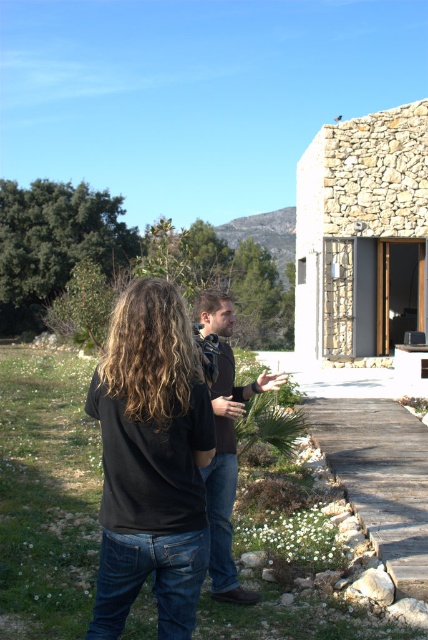
Is black matte shirt at center to the left of wooden at center from the viewer's perspective?

Correct, you'll find black matte shirt at center to the left of wooden at center.

Does black matte shirt at center have a greater width compared to wooden at center?

No.

Measure the distance between black matte shirt at center and camera.

They are 2.58 meters apart.

The height and width of the screenshot is (640, 428). I want to click on black matte shirt at center, so click(x=151, y=461).

Consider the image. Can you confirm if black matte shirt at center is positioned to the right of brown leather jacket at center?

In fact, black matte shirt at center is to the left of brown leather jacket at center.

This screenshot has width=428, height=640. Identify the location of black matte shirt at center. (151, 461).

In the scene shown: Is wooden at center thinner than brown leather jacket at center?

No, wooden at center is not thinner than brown leather jacket at center.

Does point (354, 424) come farther from viewer compared to point (223, 464)?

Yes, point (354, 424) is behind point (223, 464).

Does point (403, 518) come farther from viewer compared to point (226, 428)?

Yes, point (403, 518) is behind point (226, 428).

Image resolution: width=428 pixels, height=640 pixels. What are the coordinates of `wooden at center` in the screenshot? It's located at (380, 477).